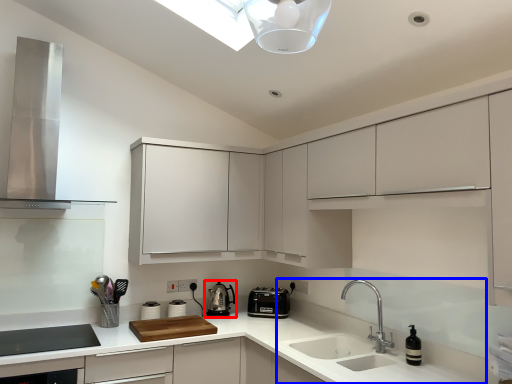
Question: Which point is closer to the camera, kitchen appliance (highlighted by a red box) or sink (highlighted by a blue box)?

Choices:
 (A) kitchen appliance
 (B) sink

Answer: (B)